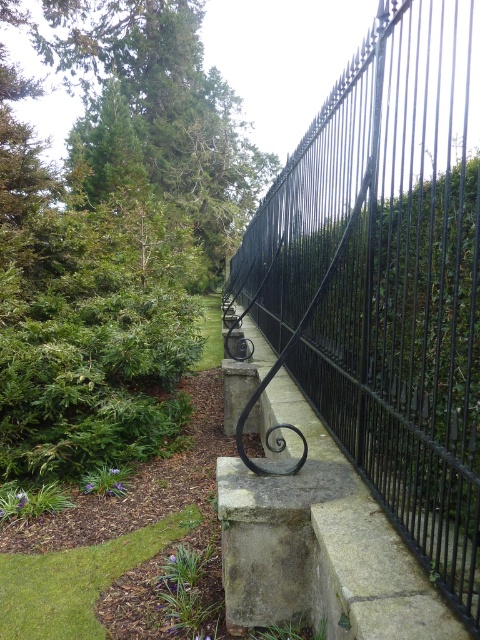
You are standing in the garden scene described. You see a point marked at coordinates (388, 280). Which object does this point correspond to?

The point at coordinates (388, 280) corresponds to the black wrought iron fence at right.

You are standing in the garden and want to take a photo of the black wrought iron fence at right and the green leafy tree at upper left. Which object should you focus on first if you want to capture both in the same frame without moving the camera?

The black wrought iron fence at right is below the green leafy tree at upper left, so you should focus on the green leafy tree at upper left first to ensure both are in the frame.

You are a gardener planning to plant a new flower bed between the green leafy tree at upper left and the gray concrete at center. Based on their positions, which object is higher up in the image?

The green leafy tree at upper left is located above the gray concrete at center, so it is higher up in the image.